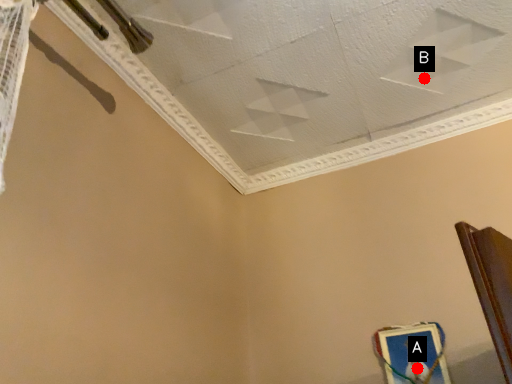
Question: Two points are circled on the image, labeled by A and B beside each circle. Which point is farther from the camera taking this photo?

Choices:
 (A) A is further
 (B) B is further

Answer: (B)